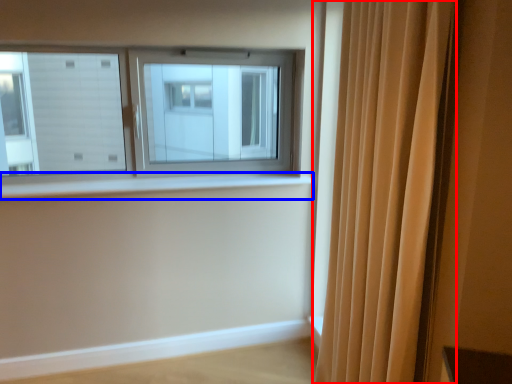
Question: Which object is closer to the camera taking this photo, curtain (highlighted by a red box) or window sill (highlighted by a blue box)?

Choices:
 (A) curtain
 (B) window sill

Answer: (A)